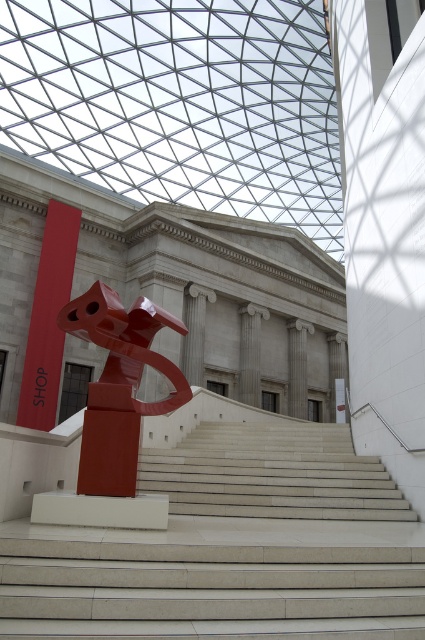
Can you confirm if matte red sculpture at center is taller than matte red sign at left?

In fact, matte red sculpture at center may be shorter than matte red sign at left.

Locate an element on the screen. matte red sculpture at center is located at coordinates (119, 385).

Looking at this image, is white marble stairs at center smaller than matte red sculpture at center?

Actually, white marble stairs at center might be larger than matte red sculpture at center.

Is point (223, 484) positioned behind point (136, 461)?

That is True.

Find the location of a particular element. white marble stairs at center is located at coordinates (232, 548).

Find the location of a particular element. The image size is (425, 640). white marble stairs at center is located at coordinates (232, 548).

Which is more to the left, white marble stairs at center or matte red sign at left?

Positioned to the left is matte red sign at left.

Is white marble stairs at center taller than matte red sign at left?

No, white marble stairs at center is not taller than matte red sign at left.

What do you see at coordinates (232, 548) in the screenshot? Image resolution: width=425 pixels, height=640 pixels. I see `white marble stairs at center` at bounding box center [232, 548].

What are the coordinates of `white marble stairs at center` in the screenshot? It's located at (232, 548).